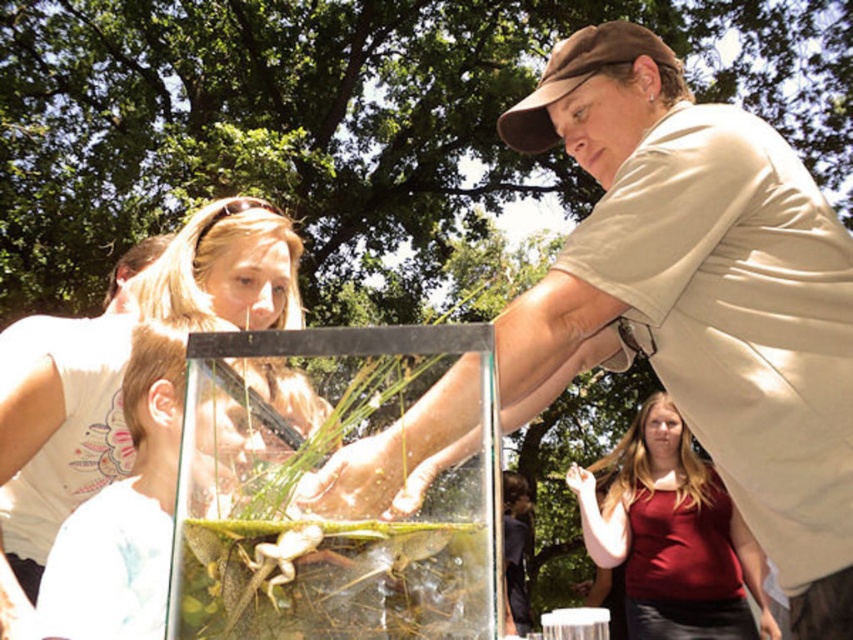
Question: Can you confirm if matte beige shirt at center is positioned below transparent glass box at center?

Choices:
 (A) yes
 (B) no

Answer: (B)

Question: Which object is the closest to the matte red tank top at center?

Choices:
 (A) transparent glass box at center
 (B) matte beige shirt at center

Answer: (B)

Question: Is matte white shirt at center thinner than matte red tank top at center?

Choices:
 (A) no
 (B) yes

Answer: (B)

Question: Which of the following is the closest to the observer?

Choices:
 (A) matte beige shirt at center
 (B) brown fabric cap at upper center
 (C) matte red tank top at center
 (D) matte white shirt at center

Answer: (A)

Question: Which object is closer to the camera taking this photo?

Choices:
 (A) matte white shirt at center
 (B) brown fabric cap at upper center
 (C) matte red tank top at center
 (D) transparent glass box at center

Answer: (D)

Question: Can you confirm if matte white shirt at center is thinner than matte red tank top at center?

Choices:
 (A) no
 (B) yes

Answer: (B)